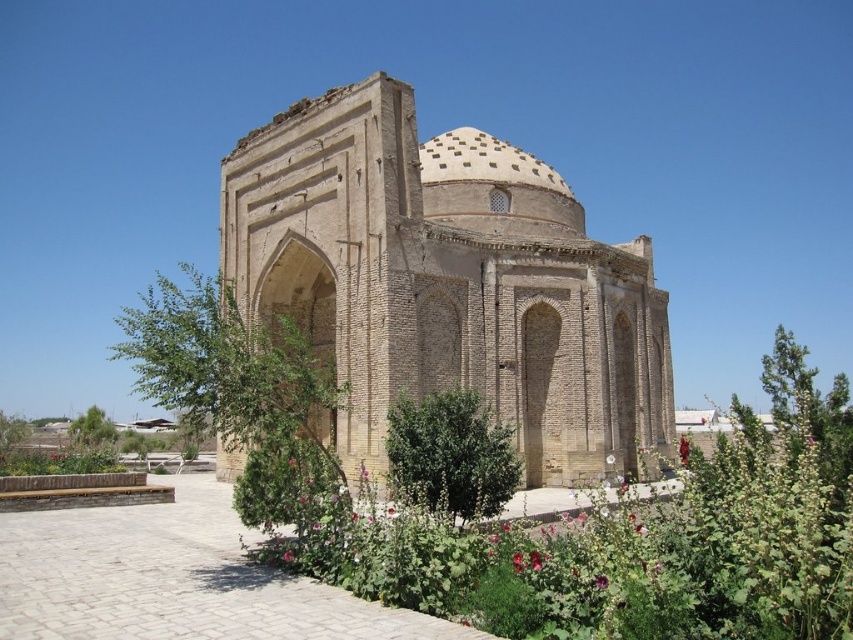
You are an archaeologist examining the ancient structure. You notice the brown brick dome at center. Can you determine its exact location in terms of coordinates?

The brown brick dome at center is located at coordinates point [447,282].

You are an archaeologist examining the ancient structure. You notice the brown brick dome at center and the green leafy plants at center. Which object is higher in height?

The brown brick dome at center is taller than the green leafy plants at center.